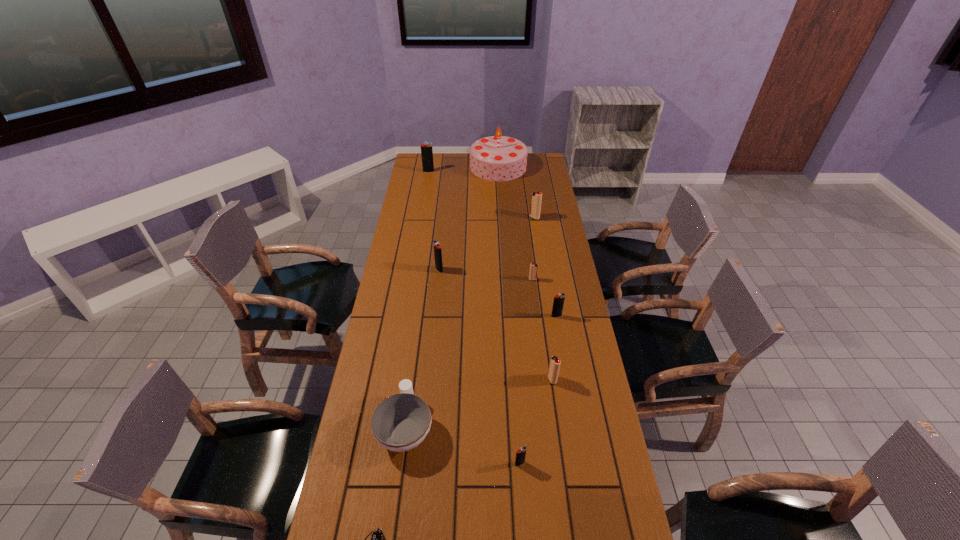
Where is `the sixth farthest igniter`? This screenshot has height=540, width=960. the sixth farthest igniter is located at coordinates [x=555, y=362].

Where is `chinaware`? The width and height of the screenshot is (960, 540). chinaware is located at coordinates (401, 422).

Identify the location of the fourth farthest igniter. (533, 272).

The width and height of the screenshot is (960, 540). I want to click on the fifth farthest object, so click(533, 272).

At what (x,y) coordinates should I click in order to perform the action: click on the third igniter from left to right. Please return your answer as a coordinate pair (x, y). The image size is (960, 540). Looking at the image, I should click on pos(520,453).

I want to click on the second black igniter from right to left, so click(520, 453).

Locate an element on the screen. This screenshot has width=960, height=540. vacant space located 0.060m on the right of the tallest object is located at coordinates (538, 167).

This screenshot has height=540, width=960. In order to click on vacant space located on the right of the leftmost black igniter in this screenshot , I will do `click(453, 172)`.

The height and width of the screenshot is (540, 960). I want to click on vacant position located on the front of the second farthest igniter, so click(x=540, y=253).

The image size is (960, 540). In order to click on free space located 0.140m on the front of the third black igniter from right to left in this screenshot , I will do pos(437,297).